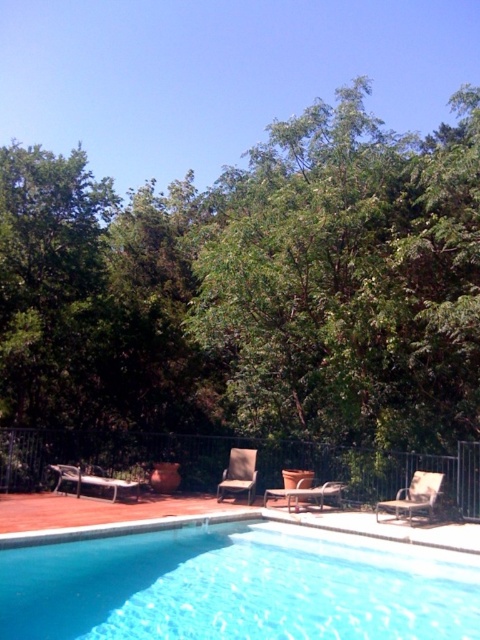
Question: Is brown woven wicker chair at lower right to the left of brown fabric chair at center from the viewer's perspective?

Choices:
 (A) yes
 (B) no

Answer: (B)

Question: Which point appears farthest from the camera in this image?

Choices:
 (A) (276, 621)
 (B) (441, 460)

Answer: (B)

Question: Which of these objects is positioned farthest from the blue glossy water at center?

Choices:
 (A) brown woven wicker chair at lower right
 (B) matte brown lounge chair at lower left
 (C) green leafy tree at upper center
 (D) matte brown lounge chair at center

Answer: (C)

Question: Can you confirm if blue glossy water at center is smaller than matte brown lounge chair at lower left?

Choices:
 (A) yes
 (B) no

Answer: (B)

Question: Where is black metal fence at lower center located in relation to brown fabric chair at center in the image?

Choices:
 (A) right
 (B) left

Answer: (A)

Question: Which object is the farthest from the black metal fence at lower center?

Choices:
 (A) blue glossy water at center
 (B) brown fabric chair at center

Answer: (A)